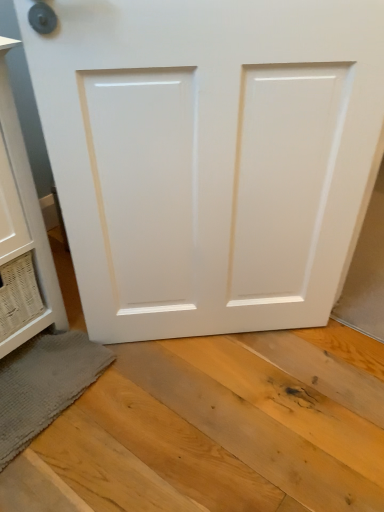
Question: Is gray textured bath mat at lower left in front of or behind white glossy cabinet at left in the image?

Choices:
 (A) front
 (B) behind

Answer: (B)

Question: From the image's perspective, is gray textured bath mat at lower left located above or below white glossy cabinet at left?

Choices:
 (A) below
 (B) above

Answer: (A)

Question: Considering the real-world distances, which object is farthest from the gray textured bath mat at lower left?

Choices:
 (A) white glossy door at center
 (B) white glossy cabinet at left

Answer: (A)

Question: Which object is the closest to the white glossy cabinet at left?

Choices:
 (A) white glossy door at center
 (B) gray textured bath mat at lower left

Answer: (B)